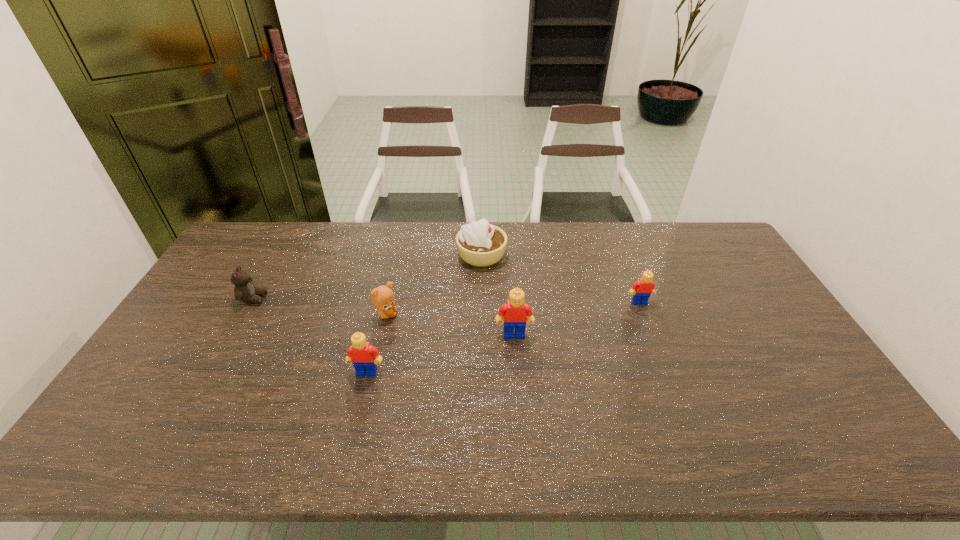
Please point a spot to add another Lego on the right. Please provide its 2D coordinates. Your answer should be formatted as a tuple, i.e. [(x, y)], where the tuple contains the x and y coordinates of a point satisfying the conditions above.

[(748, 274)]